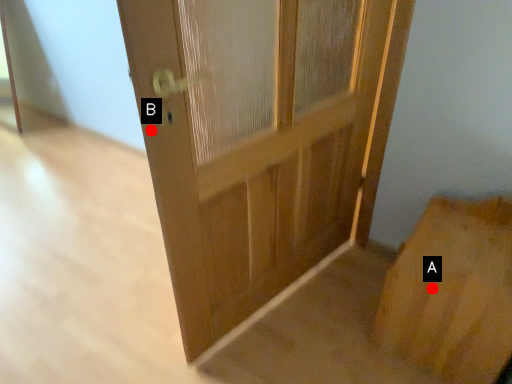
Question: Two points are circled on the image, labeled by A and B beside each circle. Which point is closer to the camera?

Choices:
 (A) A is closer
 (B) B is closer

Answer: (B)